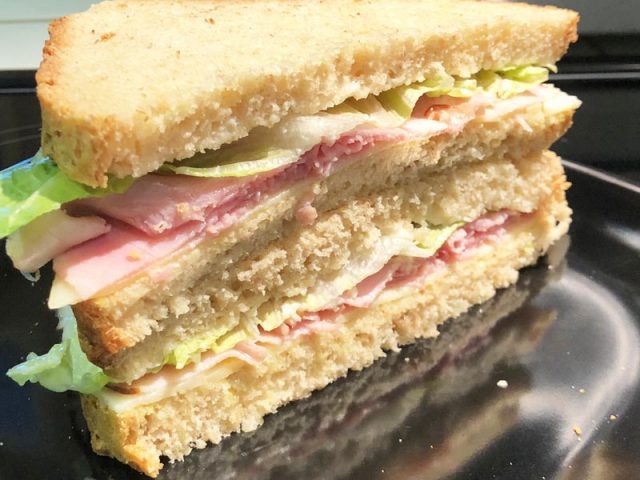
At what (x,y) coordinates should I click in order to perform the action: click on gray wall. Please return your answer as a coordinate pair (x, y). Looking at the image, I should click on (612, 96).